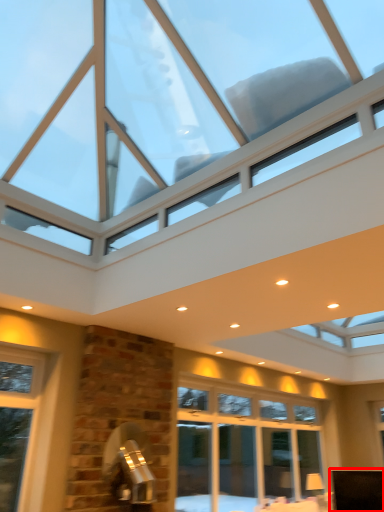
Question: From the image's perspective, what is the correct spatial positioning of furniture (annotated by the red box) in reference to window?

Choices:
 (A) below
 (B) above

Answer: (A)